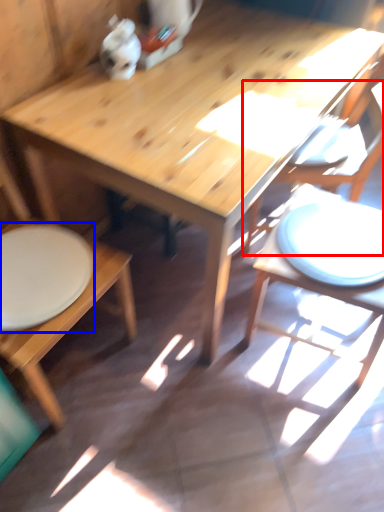
Question: Which object appears farthest to the camera in this image, chair (highlighted by a red box) or plate (highlighted by a blue box)?

Choices:
 (A) chair
 (B) plate

Answer: (A)